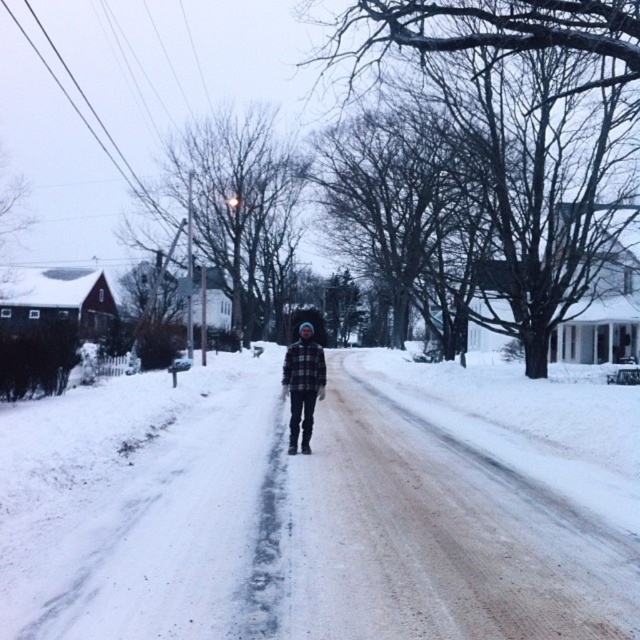
Question: Can you confirm if white fluffy snow at center is bigger than plaid flannel shirt at center?

Choices:
 (A) yes
 (B) no

Answer: (A)

Question: Which object appears closest to the camera in this image?

Choices:
 (A) plaid flannel shirt at center
 (B) white fluffy snow at center

Answer: (B)

Question: Which point is closer to the camera?

Choices:
 (A) plaid flannel shirt at center
 (B) white fluffy snow at center

Answer: (B)

Question: Is the position of white fluffy snow at center less distant than that of plaid flannel shirt at center?

Choices:
 (A) no
 (B) yes

Answer: (B)

Question: Is white fluffy snow at center further to camera compared to plaid flannel shirt at center?

Choices:
 (A) yes
 (B) no

Answer: (B)